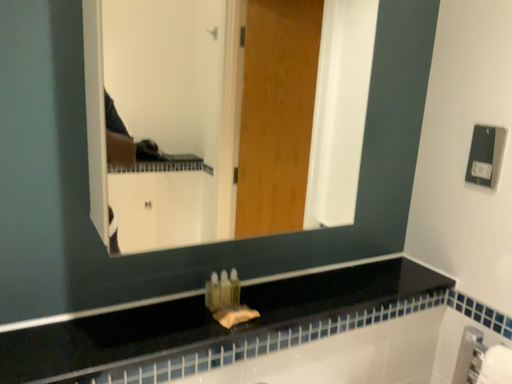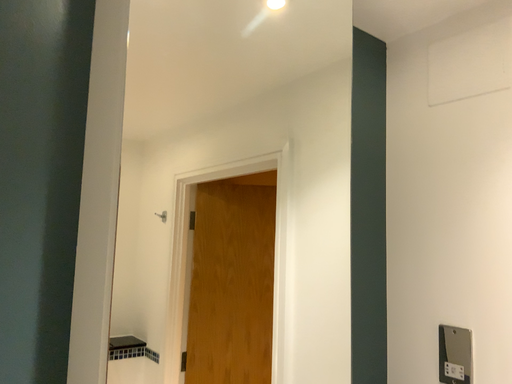
Question: How did the camera likely rotate when shooting the video?

Choices:
 (A) rotated left
 (B) rotated right

Answer: (B)